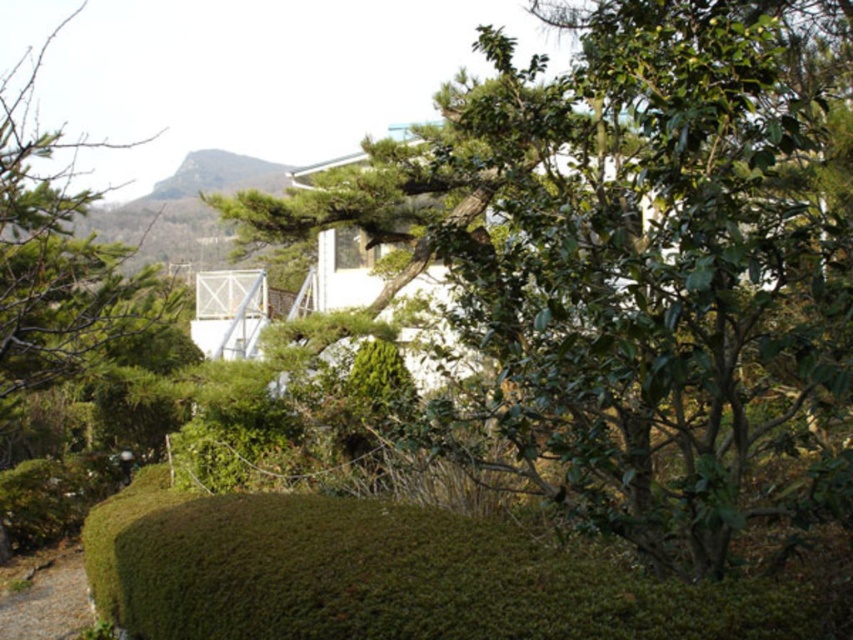
Question: Does green leafy tree at center appear over green mossy hedge at lower center?

Choices:
 (A) yes
 (B) no

Answer: (A)

Question: Can you confirm if green mossy hedge at lower center is bigger than green leafy tree at left?

Choices:
 (A) yes
 (B) no

Answer: (B)

Question: Which object appears closest to the camera in this image?

Choices:
 (A) green mossy hedge at lower center
 (B) green leafy tree at left

Answer: (A)

Question: Which point is closer to the camera?

Choices:
 (A) green leafy tree at center
 (B) green leafy tree at left

Answer: (A)

Question: Is green leafy tree at center to the left of brown dirt path at lower left from the viewer's perspective?

Choices:
 (A) yes
 (B) no

Answer: (B)

Question: Which point is closer to the camera?

Choices:
 (A) green mossy hedge at lower center
 (B) green leafy tree at left

Answer: (A)